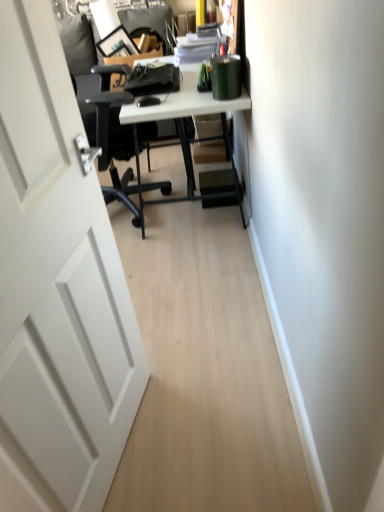
Locate an element on the screen. This screenshot has height=512, width=384. empty space that is to the right of white matte door at left is located at coordinates (214, 425).